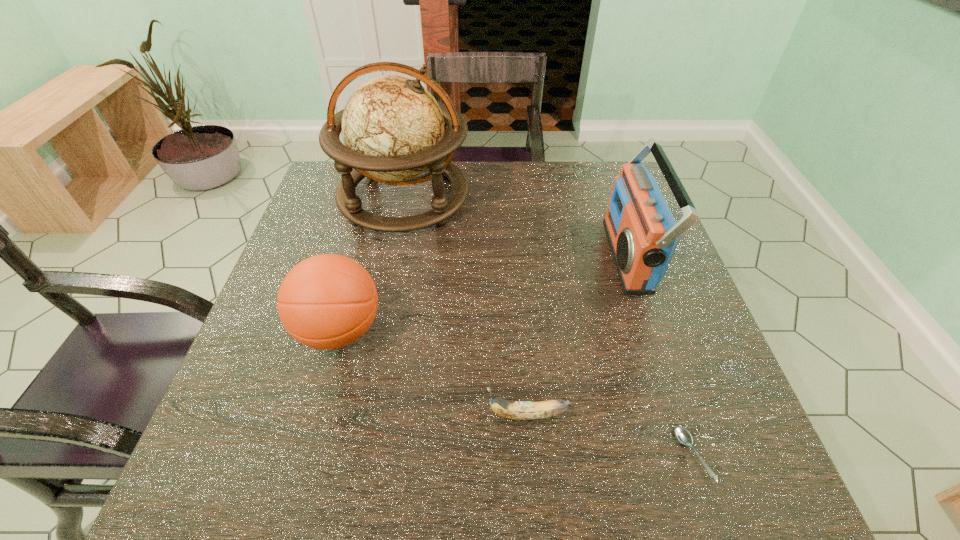
In order to click on the fourth closest object to the tallest object in this screenshot , I will do `click(683, 436)`.

Identify which object is located as the nearest to the soupspoon. Please provide its 2D coordinates. Your answer should be formatted as a tuple, i.e. [(x, y)], where the tuple contains the x and y coordinates of a point satisfying the conditions above.

[(518, 410)]

Identify the location of vacant space that satisfies the following two spatial constraints: 1. at the stem of the shortest object; 2. on the left side of the fourth tallest object. tap(531, 455).

Locate an element on the screen. The height and width of the screenshot is (540, 960). vacant point that satisfies the following two spatial constraints: 1. on the front-facing side of the second tallest object; 2. on the front side of the basketball is located at coordinates (655, 330).